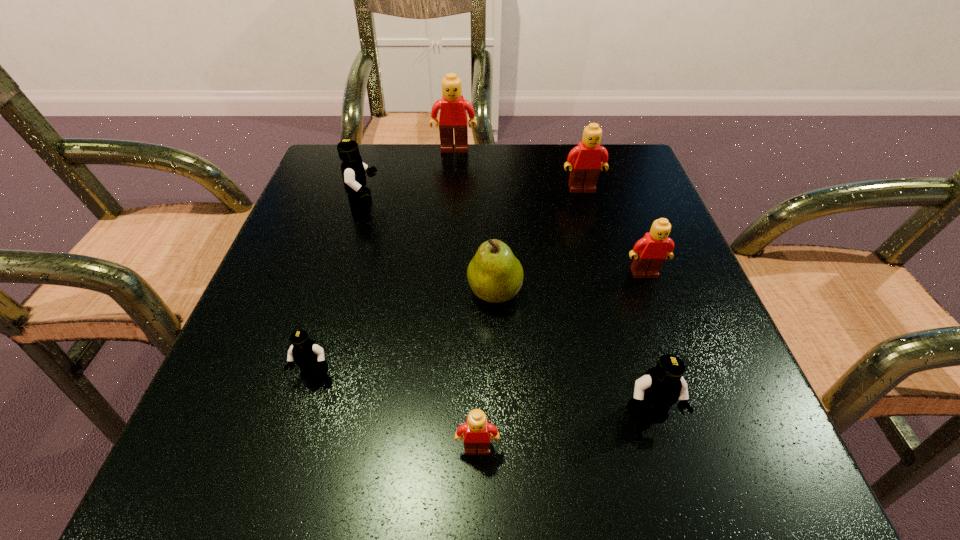
Identify the location of object that is at the far right corner. The image size is (960, 540). (585, 163).

This screenshot has width=960, height=540. I want to click on object that is positioned at the near right corner, so click(660, 387).

Find the location of a particular element. The image size is (960, 540). vacant region at the far edge is located at coordinates (452, 170).

Locate an element on the screen. free region at the near edge of the desktop is located at coordinates (372, 476).

In the image, there is a desktop. Find the location of `vacant area at the left edge`. vacant area at the left edge is located at coordinates (279, 258).

Identify the location of vacant space at the far left corner of the desktop. The width and height of the screenshot is (960, 540). (311, 185).

Identify the location of free spot at the far right corner of the desktop. (634, 185).

Where is `vacant space at the near right corner of the desktop`? This screenshot has width=960, height=540. vacant space at the near right corner of the desktop is located at coordinates (684, 442).

The image size is (960, 540). Identify the location of free area in between the rightmost black Lego and the pear. (571, 354).

You are a GUI agent. You are given a task and a screenshot of the screen. Output one action in this format:
    pyautogui.click(x=<x>, y=<y>)
    Task: Click on the free space between the smallest black Lego and the farthest black Lego
    
    Given the screenshot: What is the action you would take?
    pyautogui.click(x=340, y=290)